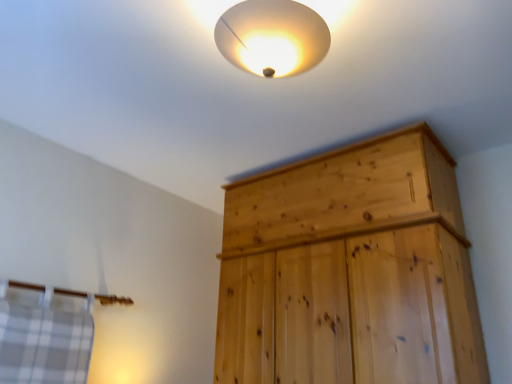
What do you see at coordinates (350, 271) in the screenshot? This screenshot has height=384, width=512. I see `natural wood cupboard at center` at bounding box center [350, 271].

You are a GUI agent. You are given a task and a screenshot of the screen. Output one action in this format:
    pyautogui.click(x=<x>, y=<y>)
    Task: Click on the natural wood cupboard at center
    The image size is (512, 384).
    Given the screenshot: What is the action you would take?
    coord(350,271)

At what (x,y) coordinates should I click in order to perform the action: click on natural wood cupboard at center. Please return your answer as a coordinate pair (x, y). The height and width of the screenshot is (384, 512). Looking at the image, I should click on (350, 271).